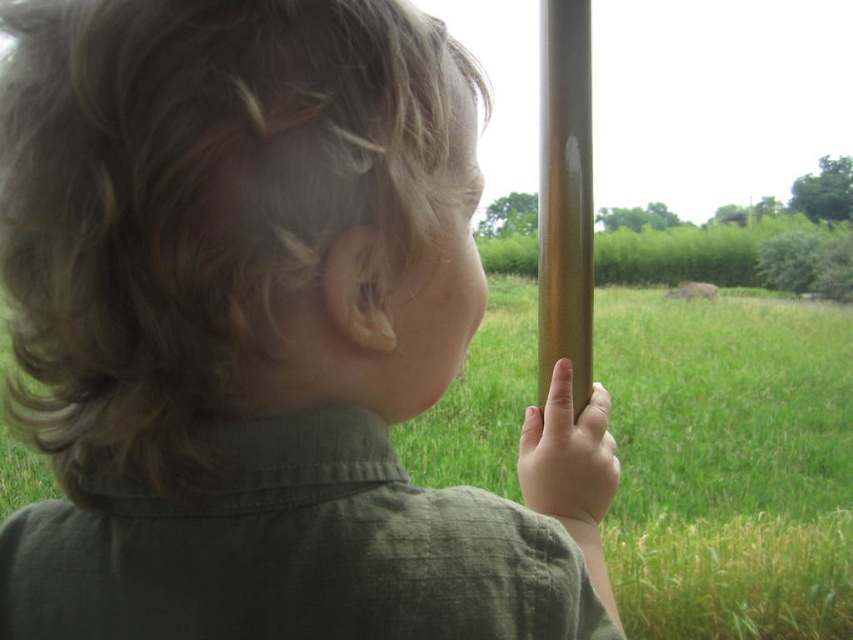
You are a parent trying to ensure your child stays safe near the window. The child is touching the green grass at center and the shiny metallic pole at center. How far apart are these two objects the child is interacting with?

The distance between the green grass at center and the shiny metallic pole at center is 14.82 meters, so they are quite far apart. The child is not in danger of touching both at the same time.

The child is touching a shiny metallic pole at center. Is the point at coordinates (564, 196) on the pole?

Yes, the point at coordinates (564, 196) is on the shiny metallic pole at center.